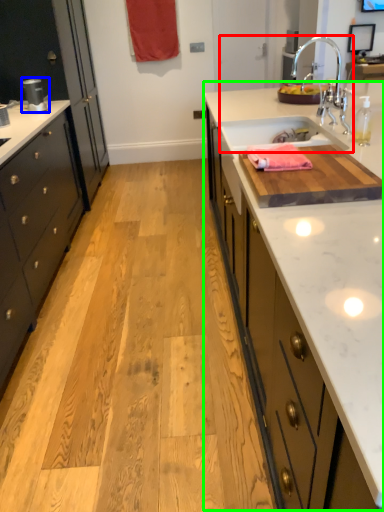
Question: Considering the real-world distances, which object is farthest from sink (highlighted by a red box)? appliance (highlighted by a blue box) or countertop (highlighted by a green box)?

Choices:
 (A) appliance
 (B) countertop

Answer: (A)